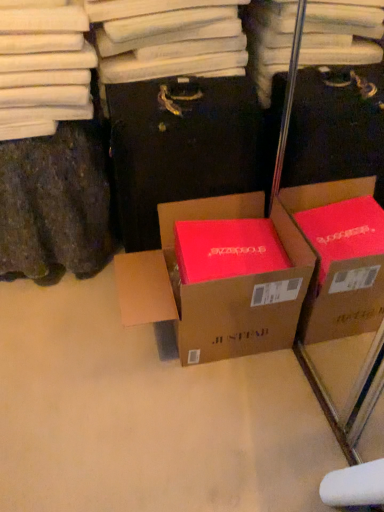
Where is `matte brown cardboard box at center`? The width and height of the screenshot is (384, 512). matte brown cardboard box at center is located at coordinates (180, 147).

What do you see at coordinates (180, 147) in the screenshot? I see `matte brown cardboard box at center` at bounding box center [180, 147].

This screenshot has height=512, width=384. In order to click on matte cardboard box at center in this screenshot , I will do `click(220, 277)`.

The width and height of the screenshot is (384, 512). What do you see at coordinates (220, 277) in the screenshot? I see `matte cardboard box at center` at bounding box center [220, 277].

The height and width of the screenshot is (512, 384). Find the location of `matte brown cardboard box at center`. matte brown cardboard box at center is located at coordinates (180, 147).

Is matte brown cardboard box at center to the right of matte cardboard box at center from the viewer's perspective?

In fact, matte brown cardboard box at center is to the left of matte cardboard box at center.

Is matte brown cardboard box at center further to the viewer compared to matte cardboard box at center?

Yes, matte brown cardboard box at center is further from the viewer.

Which is in front, point (126, 237) or point (256, 343)?

The point (256, 343) is closer to the camera.

From the image's perspective, is matte brown cardboard box at center on top of matte cardboard box at center?

Indeed, from the image's perspective, matte brown cardboard box at center is shown above matte cardboard box at center.

From a real-world perspective, is matte brown cardboard box at center on matte cardboard box at center?

Yes, from a real-world perspective, matte brown cardboard box at center is on top of matte cardboard box at center.

Considering the relative sizes of matte brown cardboard box at center and matte cardboard box at center in the image provided, is matte brown cardboard box at center thinner than matte cardboard box at center?

Correct, the width of matte brown cardboard box at center is less than that of matte cardboard box at center.

Considering the relative sizes of matte brown cardboard box at center and matte cardboard box at center in the image provided, is matte brown cardboard box at center taller than matte cardboard box at center?

Correct, matte brown cardboard box at center is much taller as matte cardboard box at center.

Between matte brown cardboard box at center and matte cardboard box at center, which one has smaller size?

matte cardboard box at center is smaller.

Is matte brown cardboard box at center completely or partially outside of matte cardboard box at center?

Indeed, matte brown cardboard box at center is completely outside matte cardboard box at center.

Are matte brown cardboard box at center and matte cardboard box at center making contact?

No, matte brown cardboard box at center is not making contact with matte cardboard box at center.

Is matte brown cardboard box at center looking in the opposite direction of matte cardboard box at center?

No, matte cardboard box at center is not at the back of matte brown cardboard box at center.

The width and height of the screenshot is (384, 512). In order to click on box that is under the matte brown cardboard box at center (from a real-world perspective) in this screenshot , I will do `click(220, 277)`.

Considering the positions of objects matte cardboard box at center and matte brown cardboard box at center in the image provided, who is more to the left, matte cardboard box at center or matte brown cardboard box at center?

From the viewer's perspective, matte brown cardboard box at center appears more on the left side.

Is matte cardboard box at center positioned in front of matte brown cardboard box at center?

That is True.

Which point is more distant from viewer, (222,266) or (255,176)?

Point (255,176)

From the image's perspective, is matte cardboard box at center below matte brown cardboard box at center?

Yes.

From a real-world perspective, is matte cardboard box at center physically below matte brown cardboard box at center?

Yes, from a real-world perspective, matte cardboard box at center is under matte brown cardboard box at center.

Considering the sizes of objects matte cardboard box at center and matte brown cardboard box at center in the image provided, who is wider, matte cardboard box at center or matte brown cardboard box at center?

matte cardboard box at center is wider.

Looking at this image, can you confirm if matte cardboard box at center is taller than matte brown cardboard box at center?

No.

Can you confirm if matte cardboard box at center is bigger than matte brown cardboard box at center?

No.

Is matte cardboard box at center situated inside matte brown cardboard box at center or outside?

matte cardboard box at center is spatially situated outside matte brown cardboard box at center.

Is matte cardboard box at center next to matte brown cardboard box at center?

They are not placed beside each other.

Is matte cardboard box at center aimed at matte brown cardboard box at center?

No, matte cardboard box at center is not aimed at matte brown cardboard box at center.

Can you tell me how much matte cardboard box at center and matte brown cardboard box at center differ in facing direction?

The angle between the facing direction of matte cardboard box at center and the facing direction of matte brown cardboard box at center is 86.9 degrees.

Locate an element on the screen. Image resolution: width=384 pixels, height=512 pixels. cardboard box above the matte cardboard box at center (from a real-world perspective) is located at coordinates (180, 147).

Find the location of a particular element. The height and width of the screenshot is (512, 384). box lying below the matte brown cardboard box at center (from the image's perspective) is located at coordinates (220, 277).

The image size is (384, 512). I want to click on cardboard box above the matte cardboard box at center (from the image's perspective), so click(x=180, y=147).